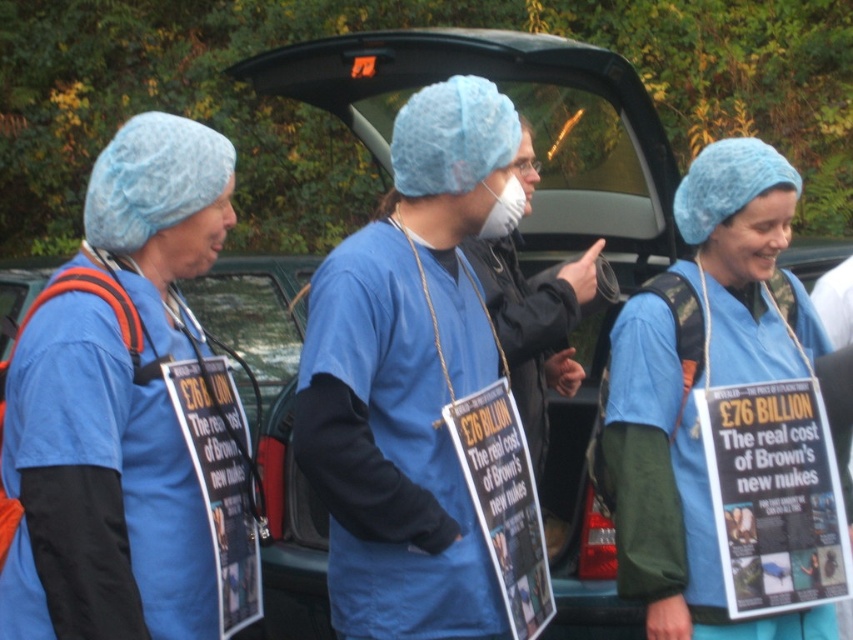
You are a photographer taking a picture of the protesters. You need to ensure both the matte blue hairnet at left and the matte blue hairnet at center are visible in the frame. Based on their positions, which hairnet should you focus on first to capture both in the shot?

The matte blue hairnet at left is to the left of the matte blue hairnet at center. To capture both in the frame, focus on the matte blue hairnet at left first, then adjust to include the one at center to the right.

You are a photographer trying to capture a clear shot of both the matte blue hairnet at left and the matte blue hairnet at center. Based on their sizes in the image, which one should you focus on to ensure it appears larger in your photo?

The matte blue hairnet at center should be focused on to appear larger because it occupies more space than the matte blue hairnet at left.

You are a photographer trying to capture a clear shot of both the matte blue hairnet at left and the matte blue hairnet at center. Based on their positions, which one is closer to the camera?

The matte blue hairnet at left is positioned over the matte blue hairnet at center, so it is closer to the camera.